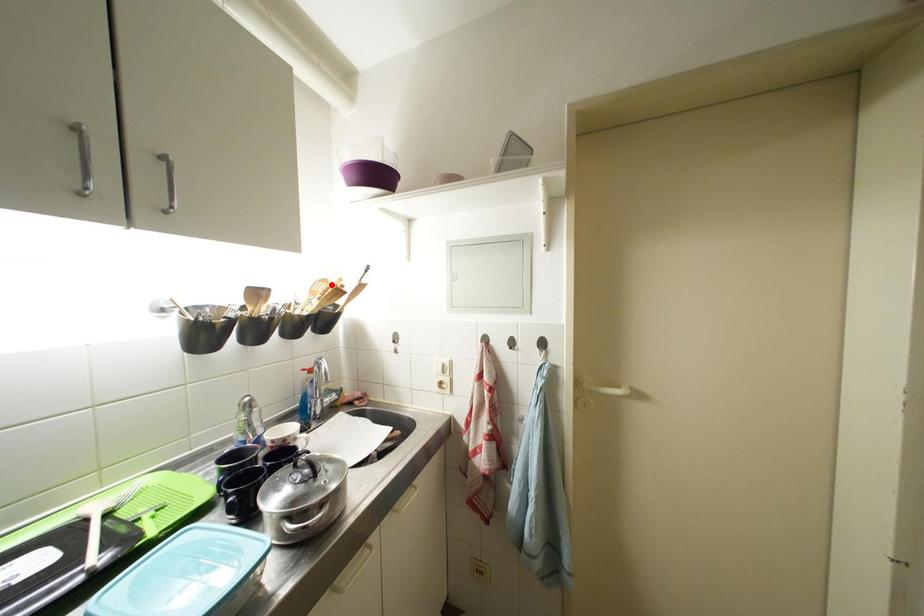
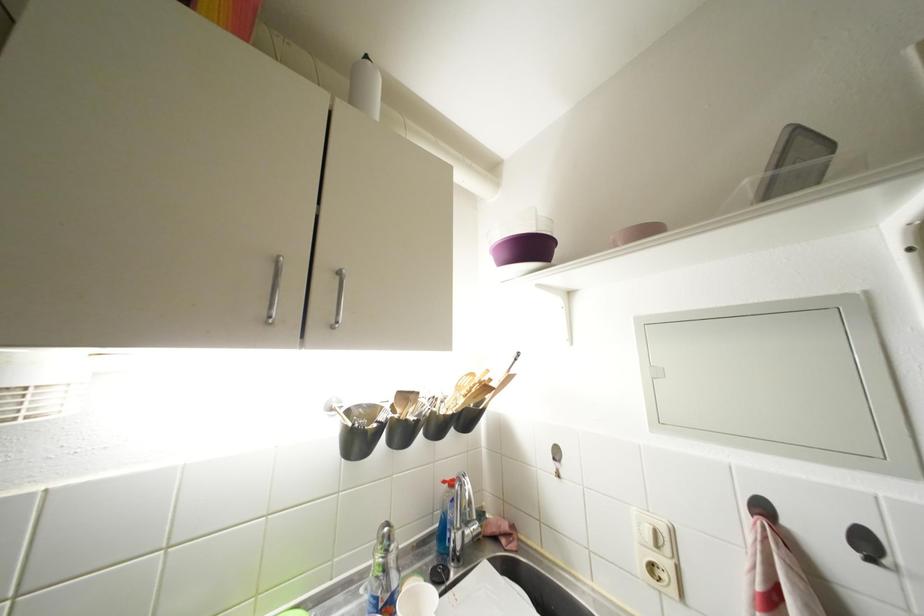
Find the pixel in the second image that matches the highlighted location in the first image.

(479, 379)